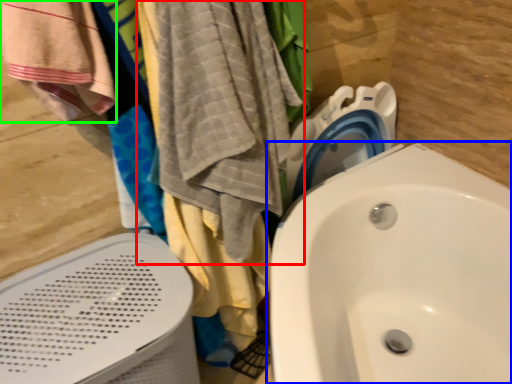
Question: Based on their relative distances, which object is farther from beach towel (highlighted by a red box)? Choose from sink (highlighted by a blue box) and beach towel (highlighted by a green box).

Choices:
 (A) sink
 (B) beach towel

Answer: (A)